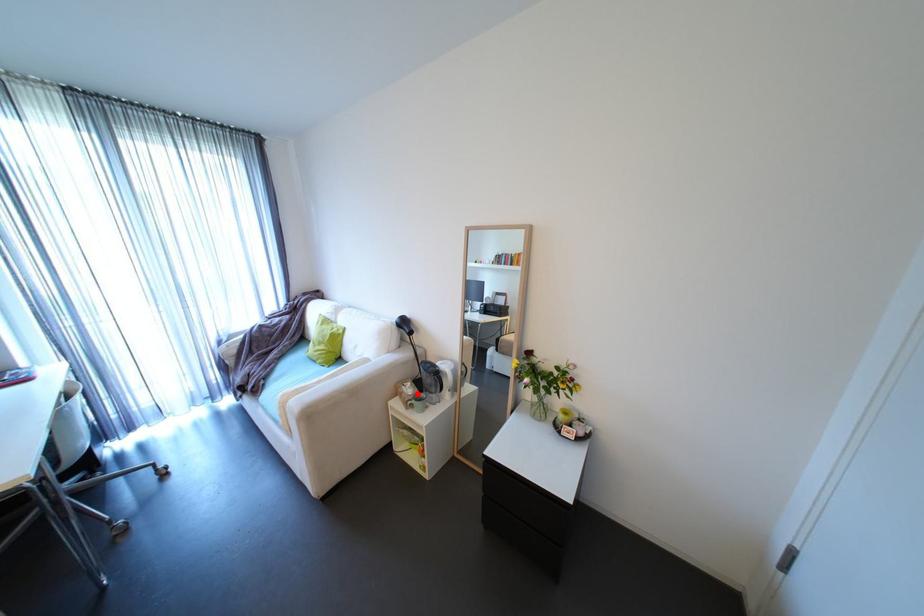
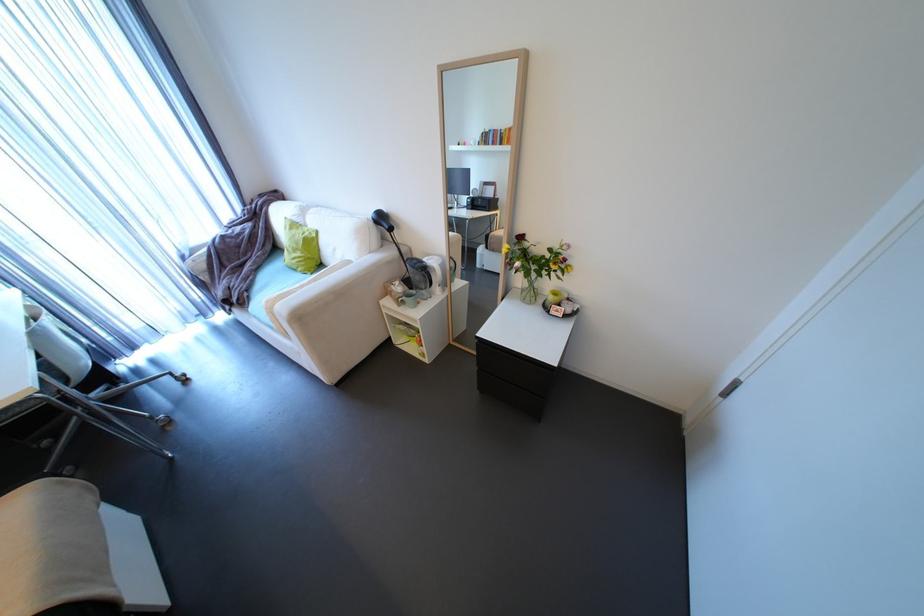
Find the pixel in the second image that matches the highlighted location in the first image.

(407, 292)